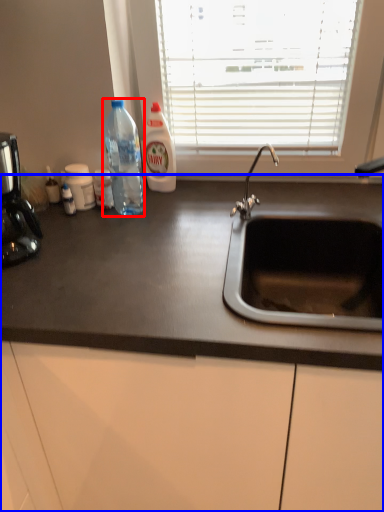
Question: Among these objects, which one is nearest to the camera, bottle (highlighted by a red box) or countertop (highlighted by a blue box)?

Choices:
 (A) bottle
 (B) countertop

Answer: (B)